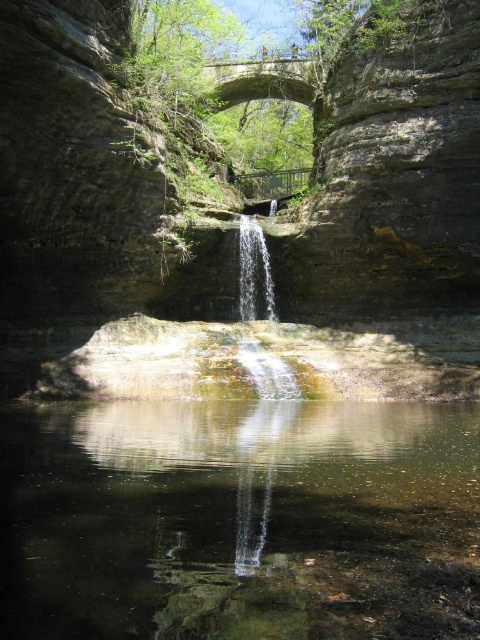
Question: Which object is positioned closest to the clear glass waterfall at center?

Choices:
 (A) smooth rock waterfall at center
 (B) clear water at center

Answer: (B)

Question: Which point is farther to the camera?

Choices:
 (A) (387, 449)
 (B) (247, 308)

Answer: (B)

Question: Is smooth rock waterfall at center wider than clear glass waterfall at center?

Choices:
 (A) no
 (B) yes

Answer: (B)

Question: Among these objects, which one is farthest from the camera?

Choices:
 (A) clear water at center
 (B) smooth rock waterfall at center
 (C) clear glass waterfall at center

Answer: (B)

Question: Observing the image, what is the correct spatial positioning of smooth rock waterfall at center in reference to clear glass waterfall at center?

Choices:
 (A) above
 (B) below

Answer: (A)

Question: Can you confirm if smooth rock waterfall at center is positioned to the left of clear glass waterfall at center?

Choices:
 (A) no
 (B) yes

Answer: (B)